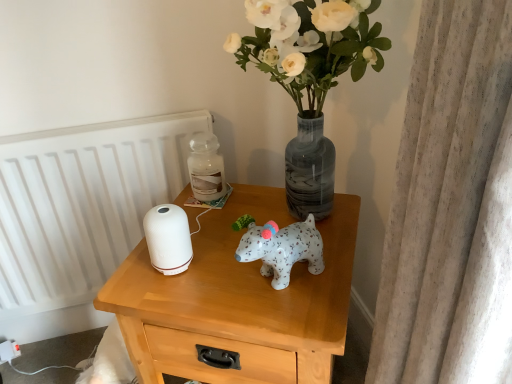
Where is `empty space that is ontop of white glossy radiator at left (from a real-world perspective)`? empty space that is ontop of white glossy radiator at left (from a real-world perspective) is located at coordinates (76, 128).